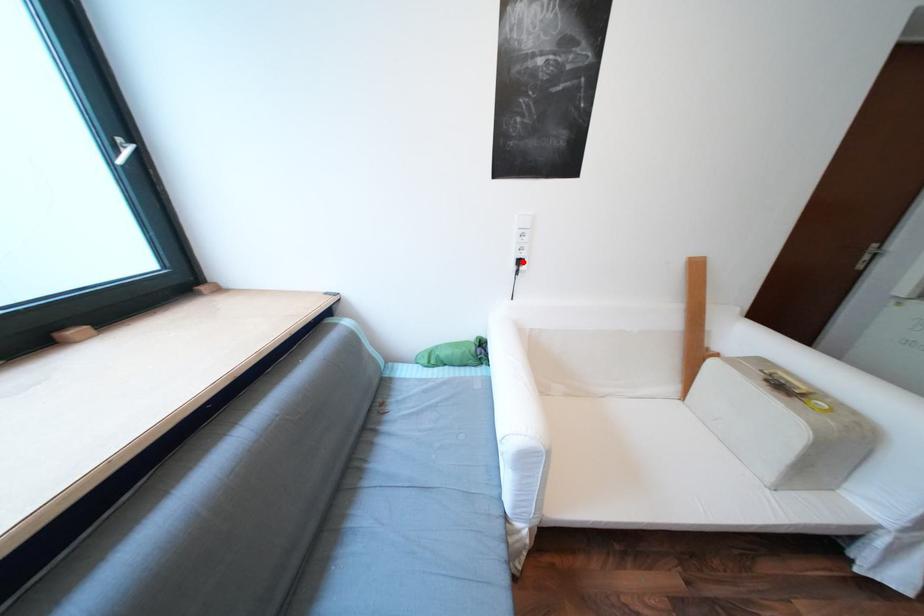
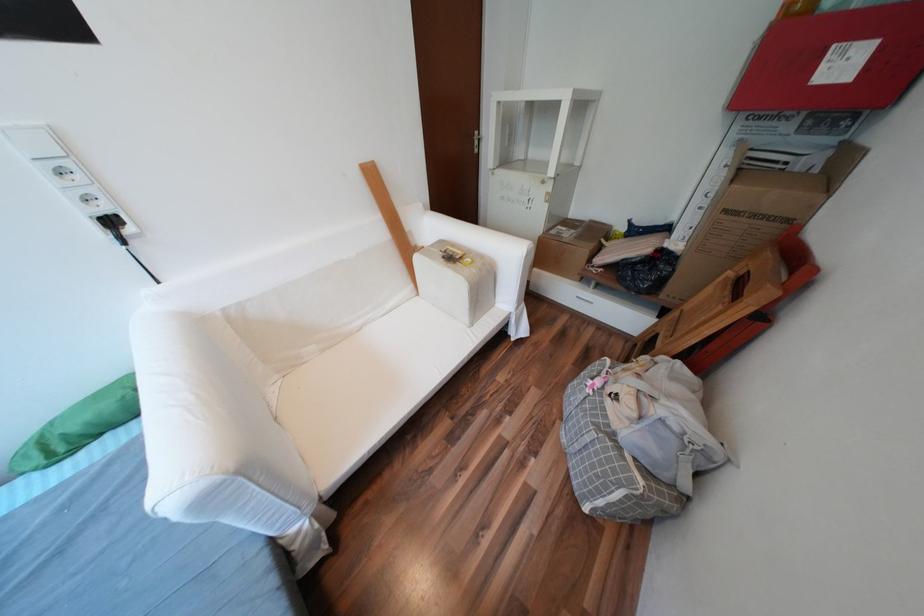
Locate, in the second image, the point that corresponds to the highlighted location in the first image.

(103, 225)